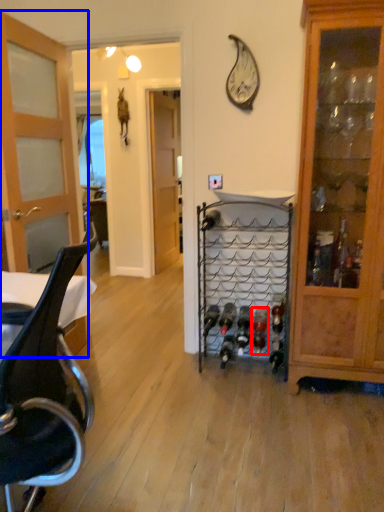
Question: Which of the following is the farthest to the observer, wine bottle (highlighted by a red box) or door (highlighted by a blue box)?

Choices:
 (A) wine bottle
 (B) door

Answer: (A)